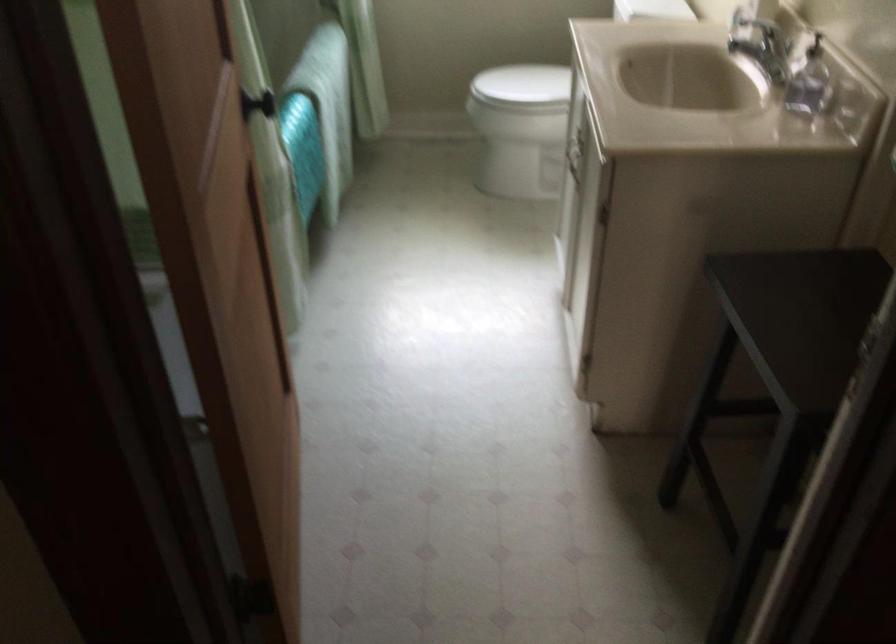
Image resolution: width=896 pixels, height=644 pixels. Identify the location of black door knob. (256, 104).